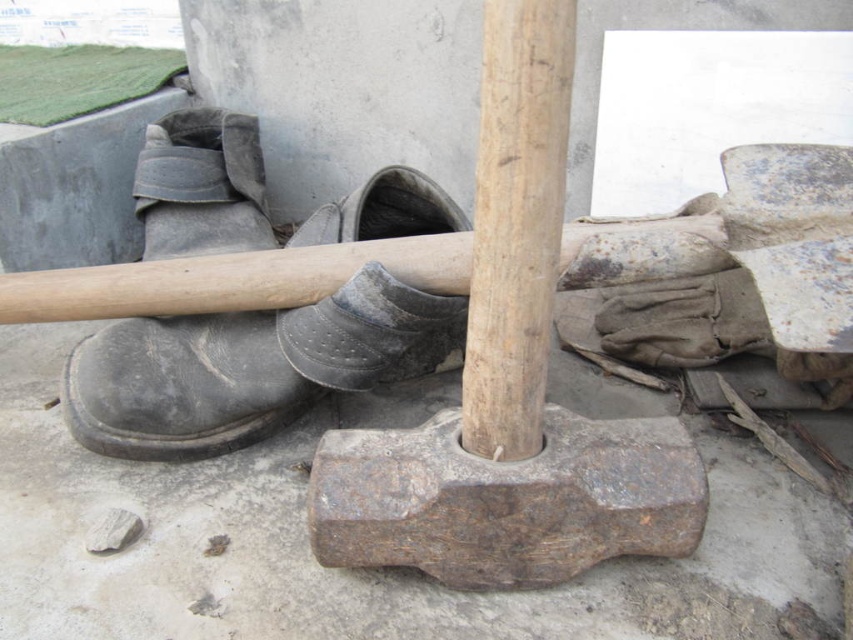
You are a construction worker who needs to move a heavy object. You have a sledgehammer and two pairs of work boots in your workspace. The sledgehammer is at point [387,461]. If you want to place the boots exactly 80 centimeters away from the sledgehammer, are they currently positioned correctly?

The boots are currently 77.25 centimeters away from the sledgehammer at point [387,461]. Since 77.25 cm is less than 80 cm, they are not positioned correctly and need to be moved further away to meet the required distance.

You are a construction worker who needs to pick up the rusty metal shovel at center and the black leather boot at left. Based on their positions, which object should you reach for first if you want to grab the one closer to your current position?

The black leather boot at left is to the left of the rusty metal shovel at center, so if you are standing in front of them, you would reach for the black leather boot at left first as it is closer to your left side.

You are organizing a tool shed and need to place the rusty metal shovel at center and the black leather boot at left into storage. Given their sizes, which item should you store first if you want to fit both into a narrow shelf?

The rusty metal shovel at center occupies less space than the black leather boot at left, so you should store the black leather boot at left first to ensure both fit on the narrow shelf.